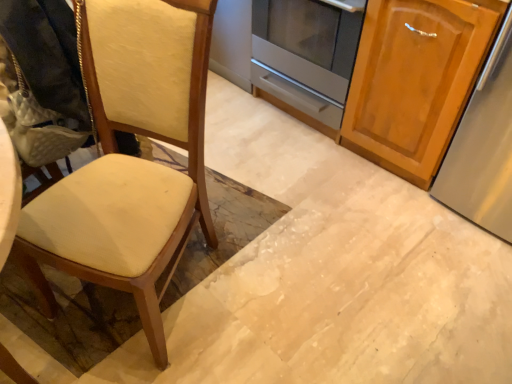
Question: Is wooden cabinet at right placed right next to satin silver oven at center?

Choices:
 (A) no
 (B) yes

Answer: (A)

Question: Can you confirm if wooden cabinet at right is thinner than satin silver oven at center?

Choices:
 (A) yes
 (B) no

Answer: (B)

Question: Considering the relative sizes of wooden cabinet at right and satin silver oven at center in the image provided, is wooden cabinet at right taller than satin silver oven at center?

Choices:
 (A) no
 (B) yes

Answer: (B)

Question: Is wooden cabinet at right oriented away from satin silver oven at center?

Choices:
 (A) yes
 (B) no

Answer: (B)

Question: Does wooden cabinet at right appear on the left side of satin silver oven at center?

Choices:
 (A) yes
 (B) no

Answer: (B)

Question: From a real-world perspective, relative to matte cream fabric chair at left, is satin silver oven at center vertically above or below?

Choices:
 (A) above
 (B) below

Answer: (B)

Question: Choose the correct answer: Is satin silver oven at center inside matte cream fabric chair at left or outside it?

Choices:
 (A) outside
 (B) inside

Answer: (A)

Question: Considering the positions of satin silver oven at center and matte cream fabric chair at left in the image, is satin silver oven at center taller or shorter than matte cream fabric chair at left?

Choices:
 (A) tall
 (B) short

Answer: (B)

Question: In the image, is satin silver oven at center positioned in front of or behind matte cream fabric chair at left?

Choices:
 (A) front
 (B) behind

Answer: (B)

Question: Based on their positions, is satin silver oven at center located to the left or right of wooden cabinet at right?

Choices:
 (A) left
 (B) right

Answer: (A)

Question: Considering the positions of satin silver oven at center and wooden cabinet at right in the image, is satin silver oven at center wider or thinner than wooden cabinet at right?

Choices:
 (A) thin
 (B) wide

Answer: (A)

Question: Would you say satin silver oven at center is inside or outside wooden cabinet at right?

Choices:
 (A) inside
 (B) outside

Answer: (B)

Question: From a real-world perspective, is satin silver oven at center positioned above or below wooden cabinet at right?

Choices:
 (A) below
 (B) above

Answer: (A)

Question: From a real-world perspective, relative to wooden cabinet at right, is matte cream fabric chair at left vertically above or below?

Choices:
 (A) below
 (B) above

Answer: (B)

Question: Considering their positions, is matte cream fabric chair at left located in front of or behind wooden cabinet at right?

Choices:
 (A) behind
 (B) front

Answer: (B)